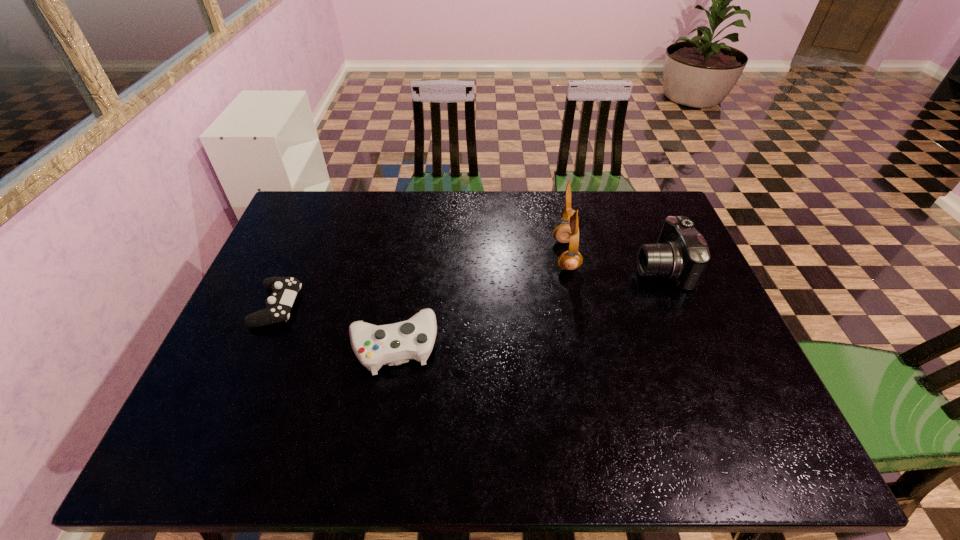
I want to click on vacant space at the left edge of the desktop, so click(x=282, y=262).

In the image, there is a desktop. Where is `vacant space at the right edge`? vacant space at the right edge is located at coordinates (710, 395).

Locate an element on the screen. This screenshot has width=960, height=540. vacant position at the far left corner of the desktop is located at coordinates (302, 219).

This screenshot has width=960, height=540. What are the coordinates of `free space between the camera and the shortest object` in the screenshot? It's located at (469, 287).

At what (x,y) coordinates should I click in order to perform the action: click on free space that is in between the third object from left to right and the third object from right to left. Please return your answer as a coordinate pair (x, y). This screenshot has height=540, width=960. Looking at the image, I should click on (480, 301).

The height and width of the screenshot is (540, 960). Find the location of `vacant area that lies between the earphone and the shortest object`. vacant area that lies between the earphone and the shortest object is located at coordinates (421, 280).

Where is `vacant space that is in between the rightmost object and the leftmost object`? The height and width of the screenshot is (540, 960). vacant space that is in between the rightmost object and the leftmost object is located at coordinates pos(469,287).

In order to click on vacant space that is in between the third object from left to right and the shorter control in this screenshot , I will do `click(421, 280)`.

Where is `empty space between the third shortest object and the earphone`? empty space between the third shortest object and the earphone is located at coordinates (613, 261).

Identify the location of free space between the second tallest object and the earphone. (613, 261).